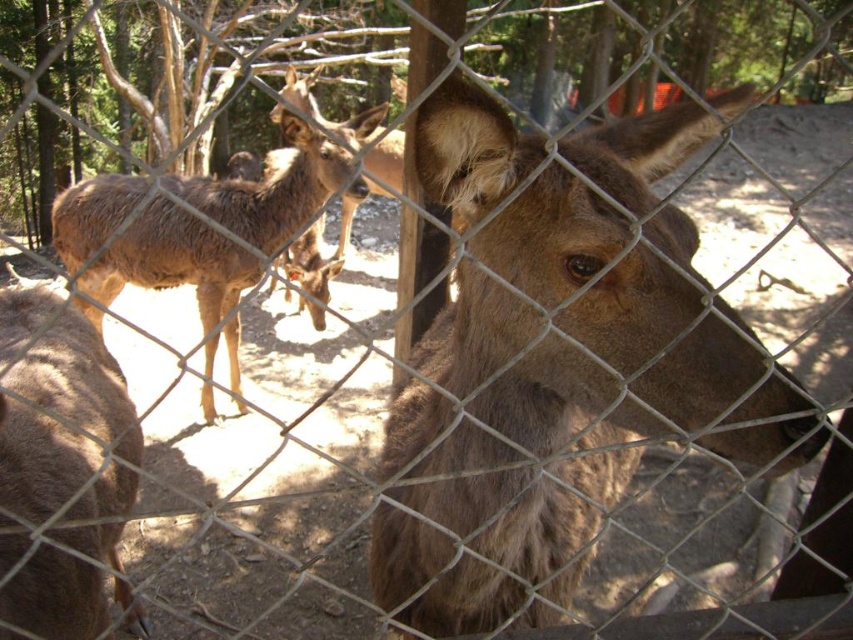
You are holding a camera and want to take a photo of the deer in the enclosure. The camera has a focus range of 90 to 100 centimeters. Is the point at coordinates point (471,474) within the camera focus range?

The distance of point (471,474) from viewer is 92.85 centimeters, so yes, it is within the camera focus range of 90 to 100 centimeters.